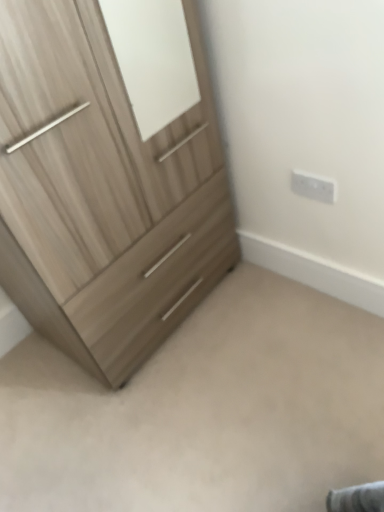
At what (x,y) coordinates should I click in order to perform the action: click on free space in front of light wood/texture chest of drawers at left. Please return your answer as a coordinate pair (x, y). Looking at the image, I should click on (175, 419).